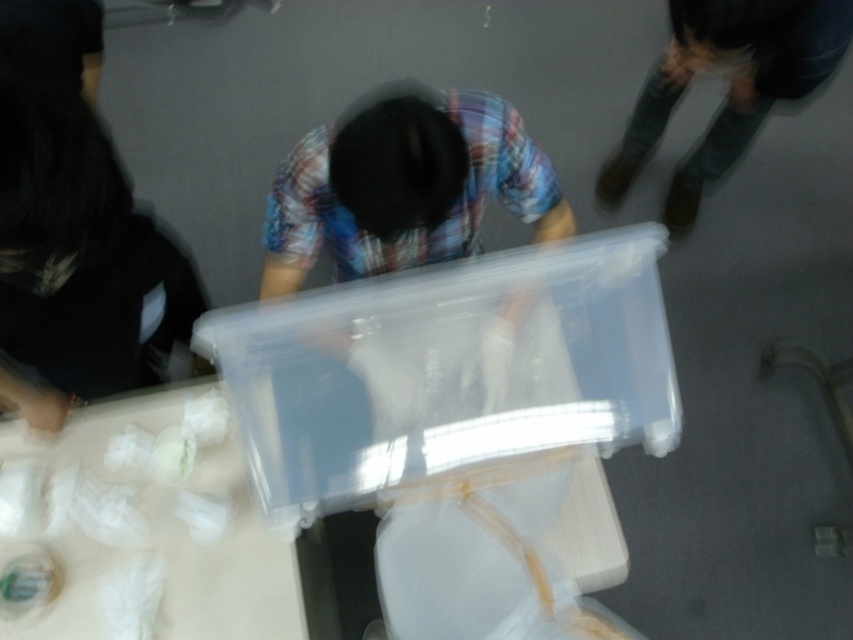
Does point (35, 145) lie behind point (694, 52)?

That is False.

Between black matte shirt at left and dark blue jeans at upper right, which one appears on the left side from the viewer's perspective?

From the viewer's perspective, black matte shirt at left appears more on the left side.

Does point (68, 259) come closer to viewer compared to point (695, 36)?

That is True.

You are a GUI agent. You are given a task and a screenshot of the screen. Output one action in this format:
    pyautogui.click(x=<x>, y=<y>)
    Task: Click on the black matte shirt at left
    Image resolution: width=853 pixels, height=640 pixels.
    Given the screenshot: What is the action you would take?
    pyautogui.click(x=74, y=262)

Who is positioned more to the right, translucent plastic table at lower left or dark blue jeans at upper right?

Positioned to the right is dark blue jeans at upper right.

Consider the image. Which is below, translucent plastic table at lower left or dark blue jeans at upper right?

translucent plastic table at lower left is lower down.

The image size is (853, 640). In order to click on translucent plastic table at lower left in this screenshot , I will do `click(146, 524)`.

Identify the location of translucent plastic table at lower left. (146, 524).

Which is above, translucent plastic table at lower left or black matte shirt at left?

black matte shirt at left is higher up.

Is point (219, 513) behind point (19, 104)?

That is True.

Locate an element on the screen. The width and height of the screenshot is (853, 640). translucent plastic table at lower left is located at coordinates (146, 524).